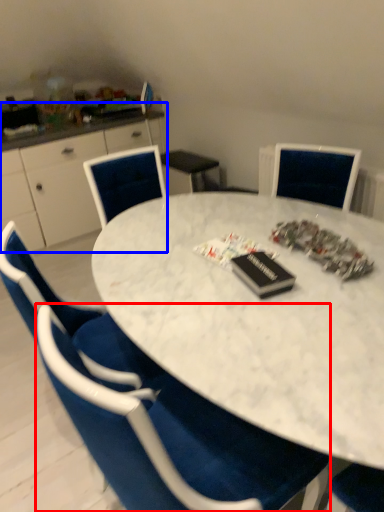
Question: Among these objects, which one is nearest to the camera, chair (highlighted by a red box) or computer desk (highlighted by a blue box)?

Choices:
 (A) chair
 (B) computer desk

Answer: (A)